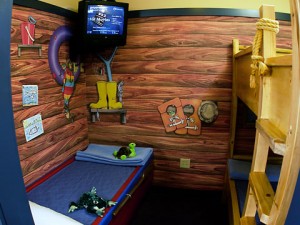
Locate an element on the screen. Image resolution: width=300 pixels, height=225 pixels. 1 set of stairs is located at coordinates (274, 141).